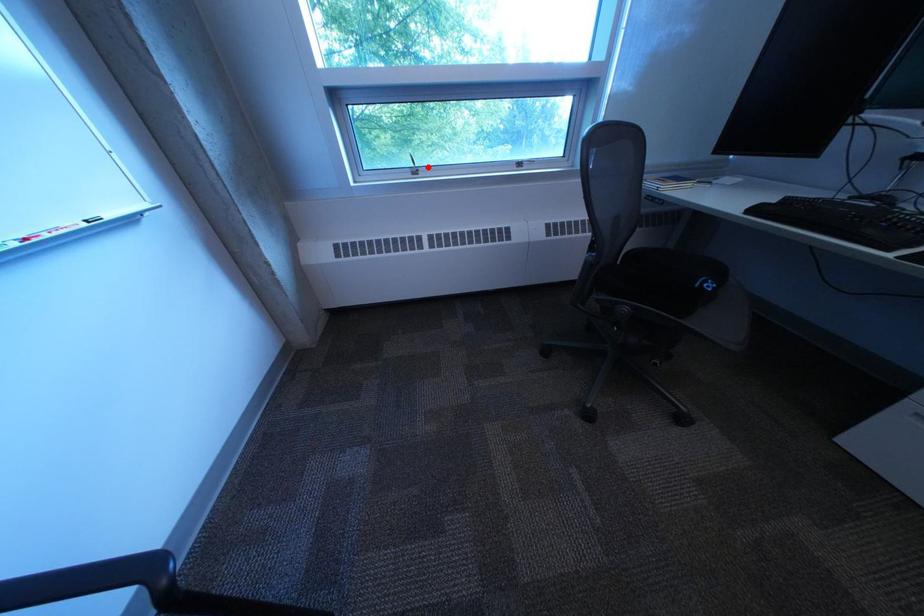
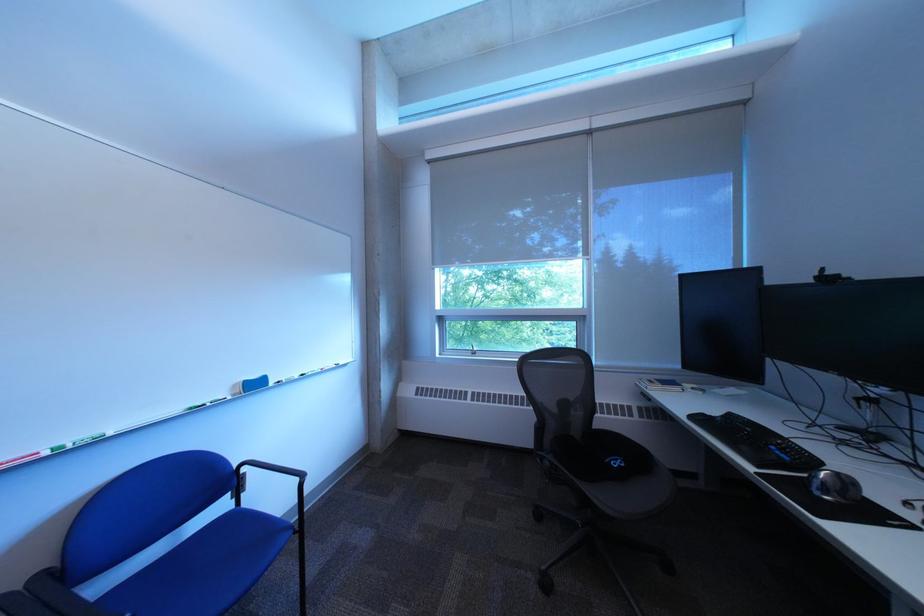
Question: I am providing you with two images of the same scene from different viewpoints. A red point is marked on the first image. At the location where the point appears in image 1, is it still visible in image 2?

Choices:
 (A) Yes
 (B) No

Answer: (A)